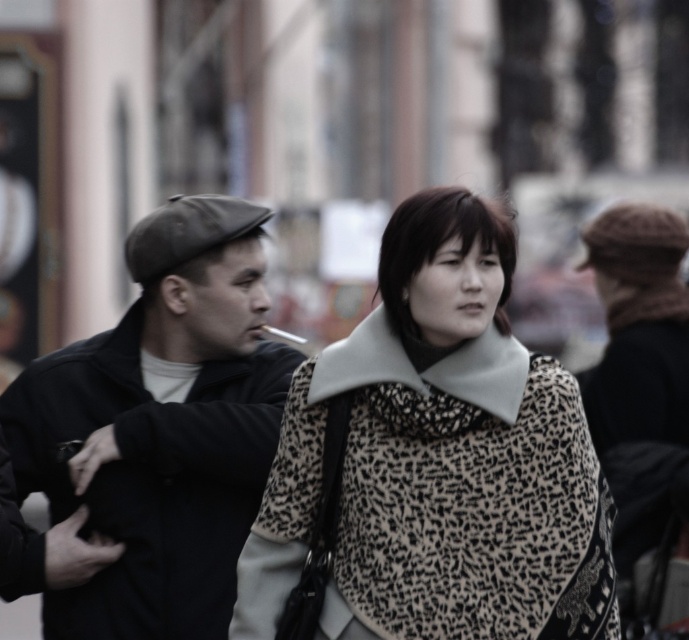
Question: Is leopard print scarf at center smaller than matte black jacket at left?

Choices:
 (A) no
 (B) yes

Answer: (B)

Question: Does leopard print scarf at center appear on the left side of matte black jacket at left?

Choices:
 (A) no
 (B) yes

Answer: (A)

Question: Does leopard print scarf at center appear on the right side of matte black jacket at left?

Choices:
 (A) yes
 (B) no

Answer: (A)

Question: Which object is closer to the camera taking this photo?

Choices:
 (A) matte black jacket at left
 (B) leopard print scarf at center

Answer: (B)